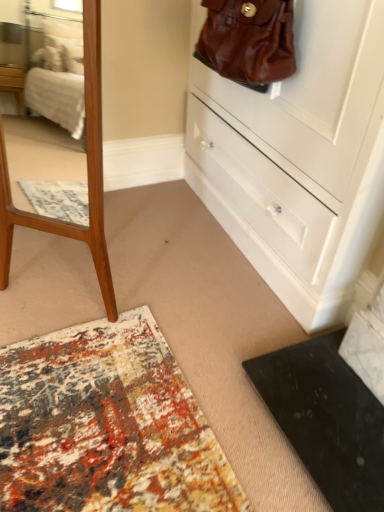
Where is `white glossy chest of drawers at upper right`? The height and width of the screenshot is (512, 384). white glossy chest of drawers at upper right is located at coordinates (299, 158).

The height and width of the screenshot is (512, 384). Describe the element at coordinates (299, 158) in the screenshot. I see `white glossy chest of drawers at upper right` at that location.

Describe the element at coordinates (248, 41) in the screenshot. Image resolution: width=384 pixels, height=512 pixels. I see `brown leather handbag at upper right` at that location.

The height and width of the screenshot is (512, 384). What are the coordinates of `brown leather handbag at upper right` in the screenshot? It's located at (248, 41).

This screenshot has width=384, height=512. Identify the location of white glossy chest of drawers at upper right. (299, 158).

Is white glossy chest of drawers at upper right at the right side of brown leather handbag at upper right?

Indeed, white glossy chest of drawers at upper right is positioned on the right side of brown leather handbag at upper right.

Relative to brown leather handbag at upper right, is white glossy chest of drawers at upper right in front or behind?

Visually, white glossy chest of drawers at upper right is located in front of brown leather handbag at upper right.

Which point is more forward, [232,114] or [199,57]?

The point [199,57] is closer to the camera.

From the image's perspective, which is above, white glossy chest of drawers at upper right or brown leather handbag at upper right?

From the image's view, brown leather handbag at upper right is above.

From a real-world perspective, is white glossy chest of drawers at upper right physically above brown leather handbag at upper right?

No.

Considering the sizes of objects white glossy chest of drawers at upper right and brown leather handbag at upper right in the image provided, who is thinner, white glossy chest of drawers at upper right or brown leather handbag at upper right?

brown leather handbag at upper right is thinner.

In terms of height, does white glossy chest of drawers at upper right look taller or shorter compared to brown leather handbag at upper right?

Clearly, white glossy chest of drawers at upper right is taller compared to brown leather handbag at upper right.

Is white glossy chest of drawers at upper right bigger than brown leather handbag at upper right?

Yes, white glossy chest of drawers at upper right is bigger than brown leather handbag at upper right.

Is white glossy chest of drawers at upper right not within brown leather handbag at upper right?

That's correct, white glossy chest of drawers at upper right is outside of brown leather handbag at upper right.

Are white glossy chest of drawers at upper right and brown leather handbag at upper right beside each other?

No, white glossy chest of drawers at upper right is not with brown leather handbag at upper right.

Is white glossy chest of drawers at upper right facing towards brown leather handbag at upper right?

Yes.

What's the angular difference between white glossy chest of drawers at upper right and brown leather handbag at upper right's facing directions?

white glossy chest of drawers at upper right and brown leather handbag at upper right are facing 0.00243 degrees away from each other.

You are a GUI agent. You are given a task and a screenshot of the screen. Output one action in this format:
    pyautogui.click(x=<x>, y=<y>)
    Task: Click on the handbag that appears behind the white glossy chest of drawers at upper right
    
    Given the screenshot: What is the action you would take?
    pyautogui.click(x=248, y=41)

Which is more to the right, brown leather handbag at upper right or white glossy chest of drawers at upper right?

white glossy chest of drawers at upper right.

Which object is closer to the camera taking this photo, brown leather handbag at upper right or white glossy chest of drawers at upper right?

white glossy chest of drawers at upper right is in front.

Which is behind, point (228, 18) or point (233, 123)?

The point (233, 123) is farther.

Based on the photo, from the image's perspective, is brown leather handbag at upper right under white glossy chest of drawers at upper right?

Actually, brown leather handbag at upper right appears above white glossy chest of drawers at upper right in the image.

From a real-world perspective, relative to white glossy chest of drawers at upper right, is brown leather handbag at upper right vertically above or below?

brown leather handbag at upper right is situated higher than white glossy chest of drawers at upper right in the real world.

Considering the sizes of brown leather handbag at upper right and white glossy chest of drawers at upper right in the image, is brown leather handbag at upper right wider or thinner than white glossy chest of drawers at upper right?

brown leather handbag at upper right is thinner than white glossy chest of drawers at upper right.

Is brown leather handbag at upper right shorter than white glossy chest of drawers at upper right?

Correct, brown leather handbag at upper right is not as tall as white glossy chest of drawers at upper right.

Is brown leather handbag at upper right smaller than white glossy chest of drawers at upper right?

Correct, brown leather handbag at upper right occupies less space than white glossy chest of drawers at upper right.

Would you say brown leather handbag at upper right contains white glossy chest of drawers at upper right?

No, brown leather handbag at upper right does not contain white glossy chest of drawers at upper right.

Would you consider brown leather handbag at upper right to be distant from white glossy chest of drawers at upper right?

Actually, brown leather handbag at upper right and white glossy chest of drawers at upper right are a little close together.

Is brown leather handbag at upper right facing towards white glossy chest of drawers at upper right?

No, brown leather handbag at upper right is not turned towards white glossy chest of drawers at upper right.

What's the angular difference between brown leather handbag at upper right and white glossy chest of drawers at upper right's facing directions?

The angle between the facing direction of brown leather handbag at upper right and the facing direction of white glossy chest of drawers at upper right is 0.00243 degrees.

How far apart are brown leather handbag at upper right and white glossy chest of drawers at upper right?

brown leather handbag at upper right and white glossy chest of drawers at upper right are 13.68 inches apart.

Identify the location of the chest of drawers that is under the brown leather handbag at upper right (from a real-world perspective). (299, 158).

The width and height of the screenshot is (384, 512). Identify the location of chest of drawers in front of the brown leather handbag at upper right. (299, 158).

Locate an element on the screen. The width and height of the screenshot is (384, 512). handbag that is on the left side of white glossy chest of drawers at upper right is located at coordinates point(248,41).